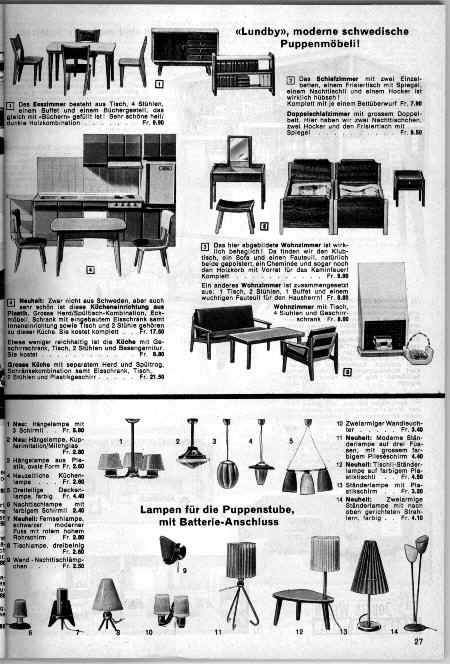
Where is `kitchen cabinets`? The image size is (450, 664). kitchen cabinets is located at coordinates (97, 145), (112, 145), (132, 147), (150, 145), (166, 145).